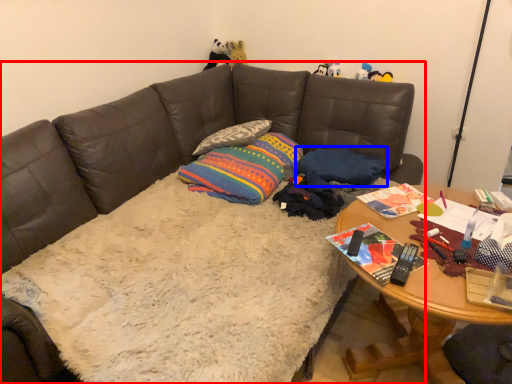
Question: Which object is closer to the camera taking this photo, studio couch (highlighted by a red box) or pillow (highlighted by a blue box)?

Choices:
 (A) studio couch
 (B) pillow

Answer: (A)